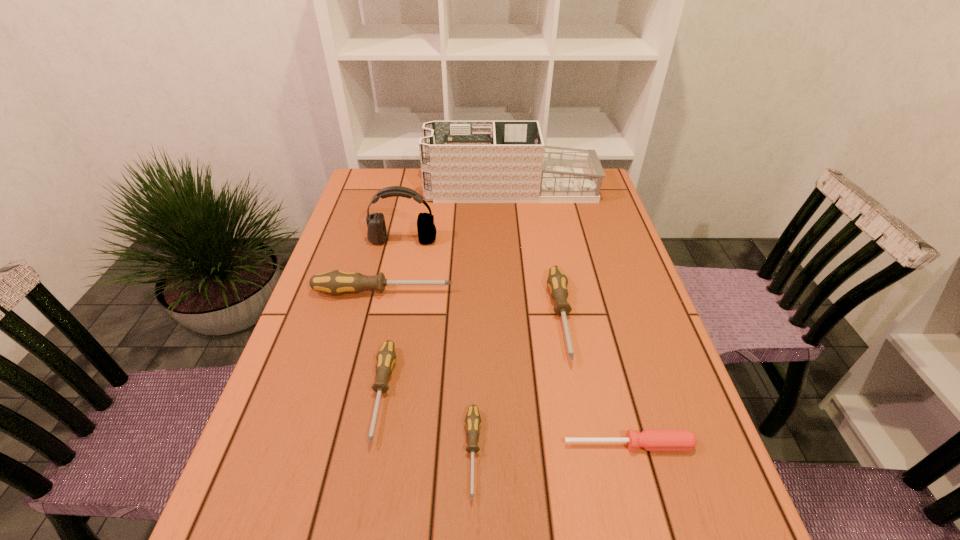
Identify the location of object at the far edge. Image resolution: width=960 pixels, height=540 pixels. (461, 161).

You are a GUI agent. You are given a task and a screenshot of the screen. Output one action in this format:
    pyautogui.click(x=<x>, y=<y>)
    Task: Click on the headset at the left edge
    This screenshot has height=540, width=960.
    Given the screenshot: What is the action you would take?
    pyautogui.click(x=376, y=233)

Identify the location of screwdriver located in the left edge section of the desktop. This screenshot has height=540, width=960. click(x=336, y=282).

Image resolution: width=960 pixels, height=540 pixels. I want to click on dollhouse situated at the right edge, so [x=461, y=161].

Find the location of `screwdriver located in the right edge section of the desktop`. screwdriver located in the right edge section of the desktop is located at coordinates point(651,440).

Identify the location of object that is at the far right corner. (461, 161).

I want to click on free spot at the left edge of the desktop, so click(x=358, y=315).

Locate an element on the screen. This screenshot has height=540, width=960. vacant space at the right edge of the desktop is located at coordinates (595, 225).

Identify the location of vacant area at the far left corner of the desktop. (387, 178).

Find the location of a particular element. Image resolution: width=960 pixels, height=540 pixels. vacant region between the headset and the rightmost gray screwdriver is located at coordinates (482, 279).